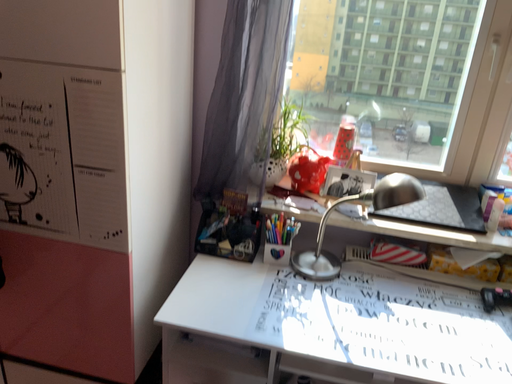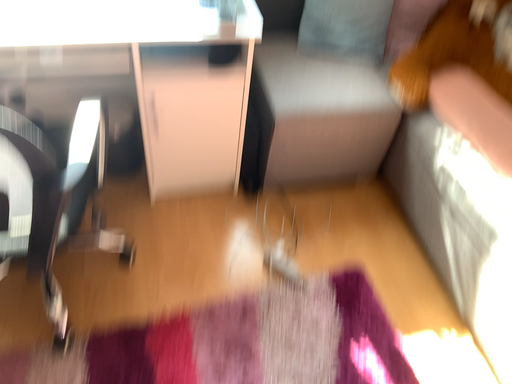
Question: Which way did the camera rotate in the video?

Choices:
 (A) rotated downward
 (B) rotated upward

Answer: (A)